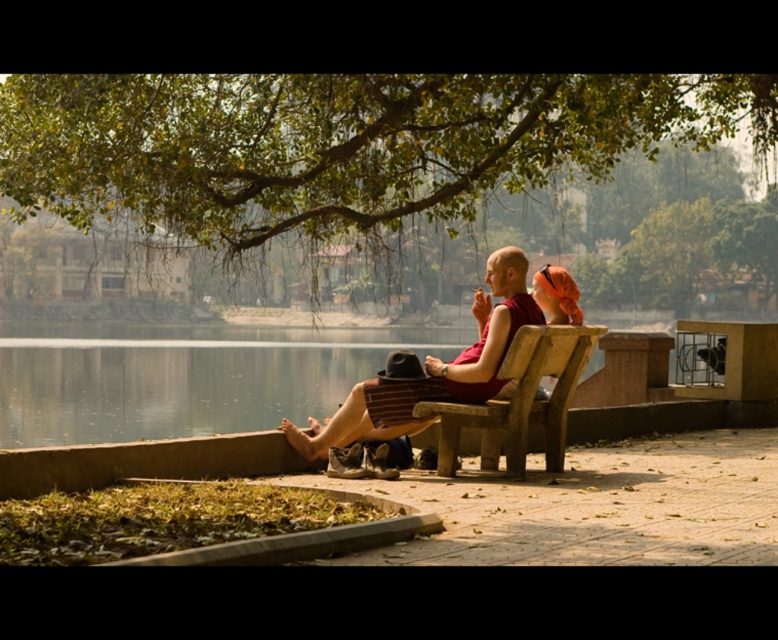
Question: Is matte red monk's robe at center to the right of matte orange headscarf at center from the viewer's perspective?

Choices:
 (A) no
 (B) yes

Answer: (A)

Question: Which point is farther from the camera taking this photo?

Choices:
 (A) [x=65, y=122]
 (B) [x=303, y=442]

Answer: (A)

Question: Considering the real-world distances, which object is farthest from the matte orange headscarf at center?

Choices:
 (A) green leafy tree at upper center
 (B) wooden park bench at center

Answer: (A)

Question: Can you confirm if wooden park bench at center is smaller than matte orange headscarf at center?

Choices:
 (A) no
 (B) yes

Answer: (A)

Question: Does matte red monk's robe at center have a greater width compared to matte orange headscarf at center?

Choices:
 (A) yes
 (B) no

Answer: (A)

Question: Estimate the real-world distances between objects in this image. Which object is farther from the green leafy tree at upper center?

Choices:
 (A) wooden park bench at center
 (B) matte orange headscarf at center
 (C) matte red monk's robe at center

Answer: (B)